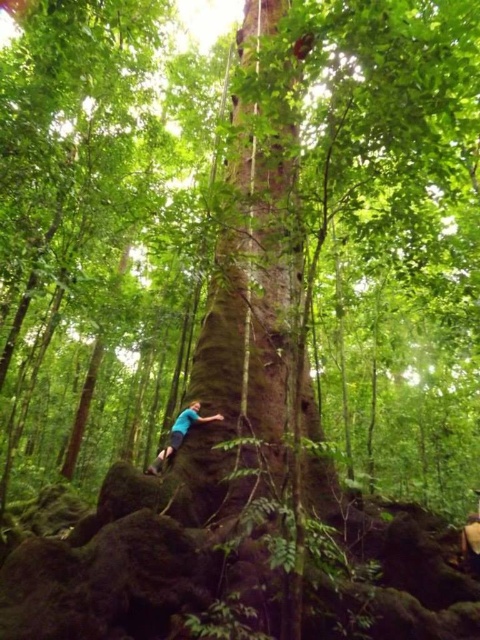
Is smooth brown tree trunk at center behind blue fabric shirt at lower center?

No, smooth brown tree trunk at center is closer to the viewer.

Who is positioned more to the left, smooth brown tree trunk at center or blue fabric shirt at lower center?

blue fabric shirt at lower center is more to the left.

You are a GUI agent. You are given a task and a screenshot of the screen. Output one action in this format:
    pyautogui.click(x=<x>, y=<y>)
    Task: Click on the smooth brown tree trunk at center
    The image size is (480, 640).
    Given the screenshot: What is the action you would take?
    pyautogui.click(x=255, y=353)